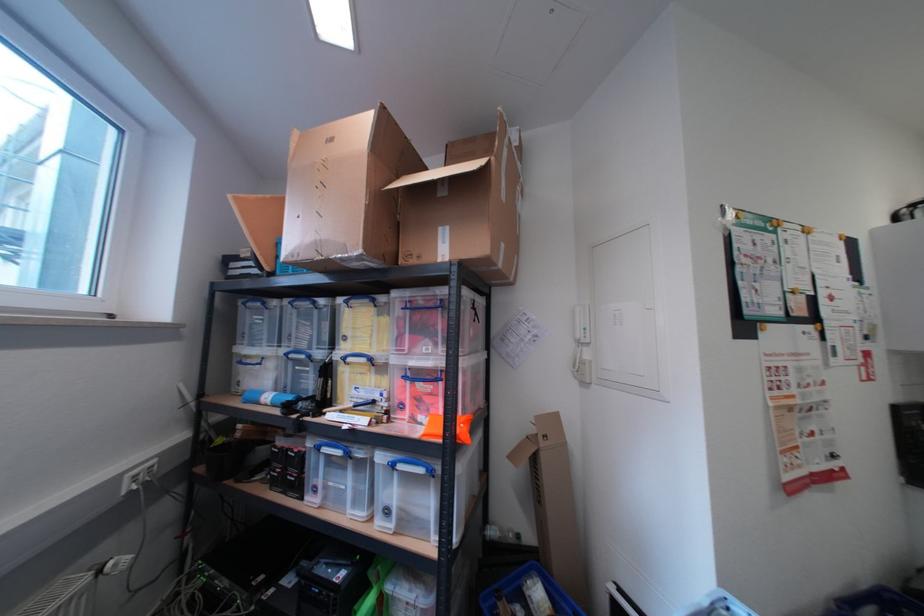
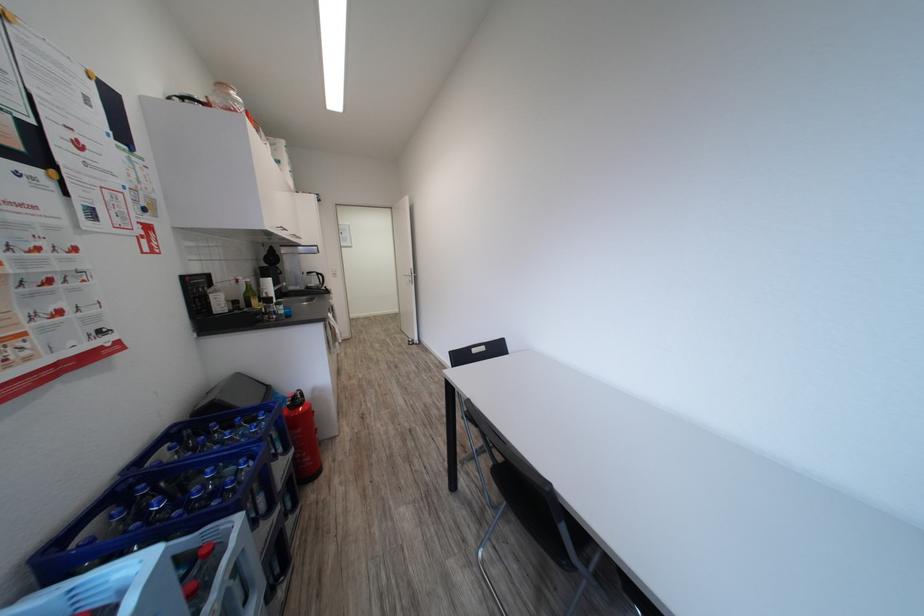
Question: The first image is from the beginning of the video and the second image is from the end. How did the camera likely rotate when shooting the video?

Choices:
 (A) Left
 (B) Right
 (C) Up
 (D) Down

Answer: (B)